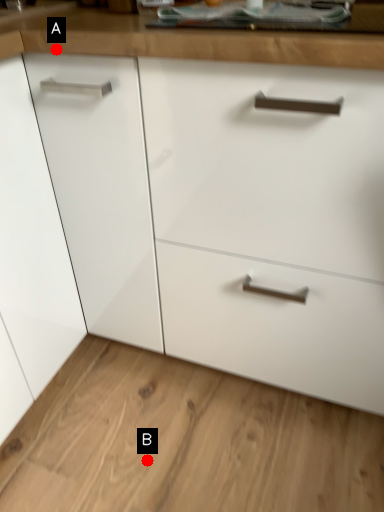
Question: Two points are circled on the image, labeled by A and B beside each circle. Which point is closer to the camera?

Choices:
 (A) A is closer
 (B) B is closer

Answer: (A)